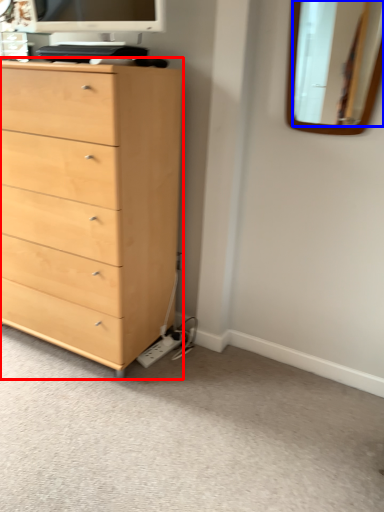
Question: Which object is closer to the camera taking this photo, chest of drawers (highlighted by a red box) or mirror (highlighted by a blue box)?

Choices:
 (A) chest of drawers
 (B) mirror

Answer: (A)